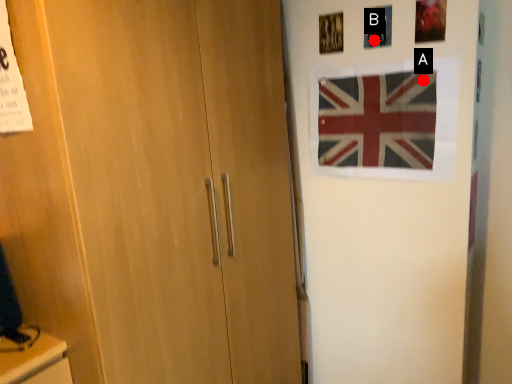
Question: Two points are circled on the image, labeled by A and B beside each circle. Among these points, which one is farthest from the camera?

Choices:
 (A) A is further
 (B) B is further

Answer: (B)